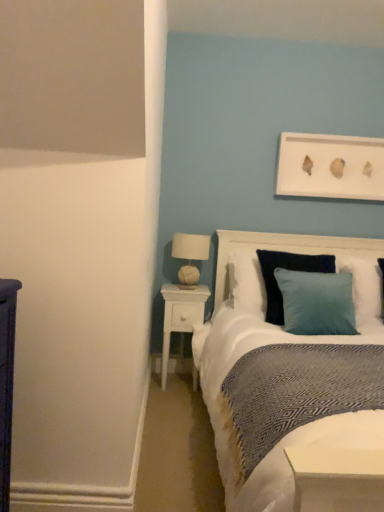
Question: From the image's perspective, is white fabric-covered lampshade at upper right located above or below white wood nightstand at center?

Choices:
 (A) above
 (B) below

Answer: (A)

Question: Is point (177, 244) closer or farther from the camera than point (183, 301)?

Choices:
 (A) closer
 (B) farther

Answer: (B)

Question: Which is nearer to the white wood nightstand at center?

Choices:
 (A) teal velvet pillow at center
 (B) white fabric-covered lampshade at upper right
 (C) white textured headboard at center

Answer: (B)

Question: Which of these objects is positioned farthest from the teal velvet pillow at center?

Choices:
 (A) white fabric-covered lampshade at upper right
 (B) white textured headboard at center
 (C) white wood nightstand at center

Answer: (C)